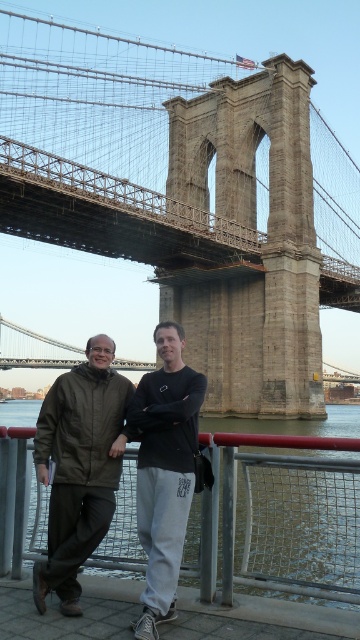
Based on the photo, is stone stone suspension bridge at center above black cotton sweatshirt at center?

Yes.

Which is behind, point (213, 365) or point (158, 355)?

Positioned behind is point (158, 355).

The image size is (360, 640). Identify the location of stone stone suspension bridge at center. (189, 195).

Image resolution: width=360 pixels, height=640 pixels. Describe the element at coordinates (189, 195) in the screenshot. I see `stone stone suspension bridge at center` at that location.

Find the location of a particular element. Image resolution: width=360 pixels, height=640 pixels. stone stone suspension bridge at center is located at coordinates (189, 195).

Who is higher up, metal/rusty rail at lower center or matte olive-green jacket at center?

matte olive-green jacket at center is higher up.

Does metal/rusty rail at lower center have a lesser width compared to matte olive-green jacket at center?

No, metal/rusty rail at lower center is not thinner than matte olive-green jacket at center.

Describe the element at coordinates (277, 518) in the screenshot. The image size is (360, 640). I see `metal/rusty rail at lower center` at that location.

Image resolution: width=360 pixels, height=640 pixels. I want to click on metal/rusty rail at lower center, so click(x=277, y=518).